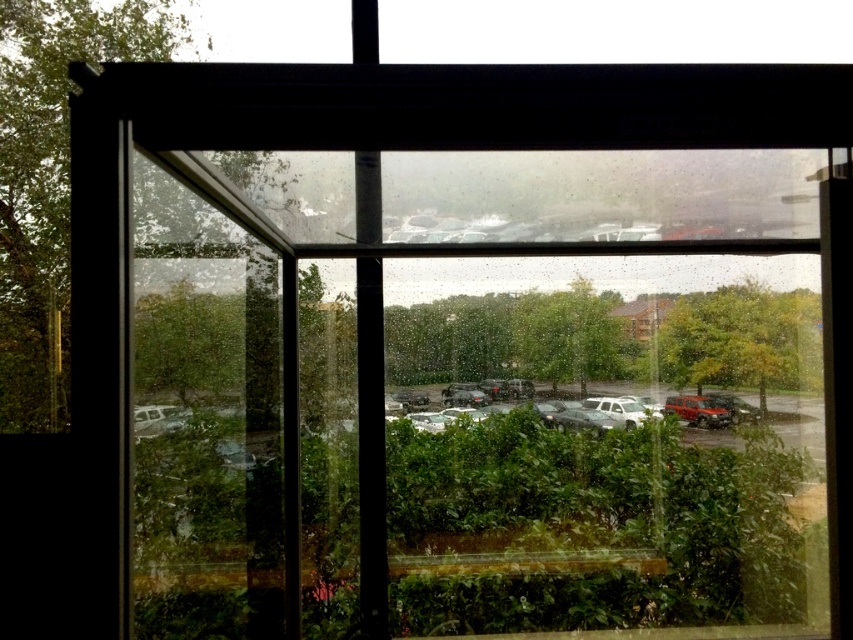
Which is behind, point (556, 392) or point (624, 413)?

Positioned behind is point (624, 413).

This screenshot has width=853, height=640. What do you see at coordinates (672, 396) in the screenshot? I see `matte silver suv at center` at bounding box center [672, 396].

This screenshot has width=853, height=640. In order to click on matte silver suv at center in this screenshot , I will do `click(672, 396)`.

The image size is (853, 640). What are the coordinates of `matte silver suv at center` in the screenshot? It's located at (672, 396).

Which is more to the right, matte silver suv at center or matte red suv at lower right?

From the viewer's perspective, matte red suv at lower right appears more on the right side.

Is matte silver suv at center below matte red suv at lower right?

No, matte silver suv at center is not below matte red suv at lower right.

Identify the location of matte silver suv at center. This screenshot has height=640, width=853. (672, 396).

The image size is (853, 640). Find the location of `matte red suv at lower right`. matte red suv at lower right is located at coordinates (695, 410).

Can you confirm if matte red suv at lower right is positioned to the left of white matte truck at center?

Incorrect, matte red suv at lower right is not on the left side of white matte truck at center.

Where is `matte red suv at lower right`? The image size is (853, 640). matte red suv at lower right is located at coordinates (695, 410).

Locate an element on the screen. The width and height of the screenshot is (853, 640). matte red suv at lower right is located at coordinates (695, 410).